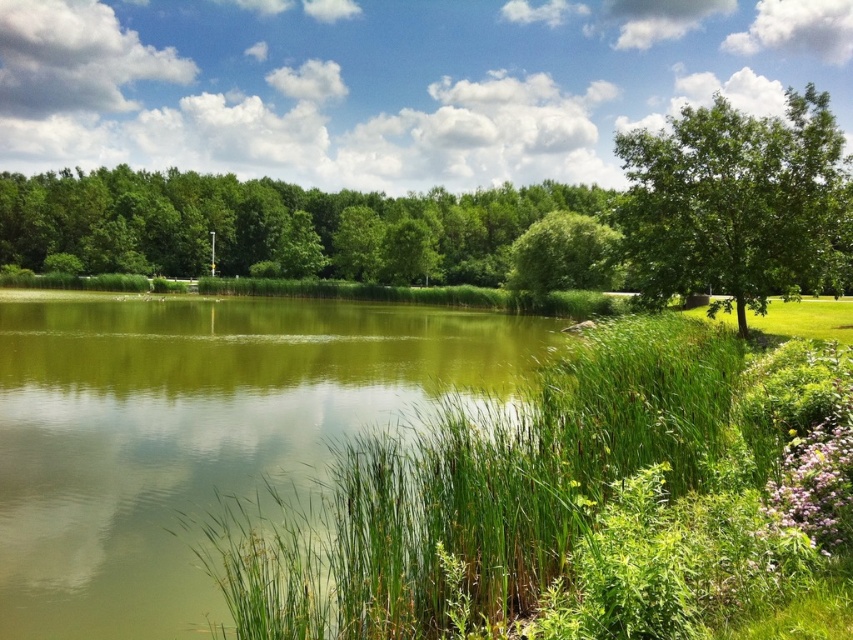
Which is behind, point (270, 440) or point (697, 221)?

Positioned behind is point (697, 221).

Who is more forward, (337, 369) or (784, 186)?

Point (784, 186) is more forward.

The height and width of the screenshot is (640, 853). In order to click on green grassy water at center in this screenshot , I will do `click(196, 433)`.

Is green grassy water at center above green leafy tree at upper center?

Incorrect, green grassy water at center is not positioned above green leafy tree at upper center.

Who is more distant from viewer, (4, 602) or (102, 205)?

The point (102, 205) is more distant.

Image resolution: width=853 pixels, height=640 pixels. In order to click on green grassy water at center in this screenshot , I will do `click(196, 433)`.

Can you confirm if green leafy tree at upper right is positioned below green leafy tree at center?

Yes.

Which is below, green leafy tree at upper right or green leafy tree at center?

green leafy tree at upper right

Which is in front, point (793, 116) or point (593, 228)?

Point (793, 116) is more forward.

This screenshot has height=640, width=853. Find the location of `green leafy tree at upper right`. green leafy tree at upper right is located at coordinates (737, 204).